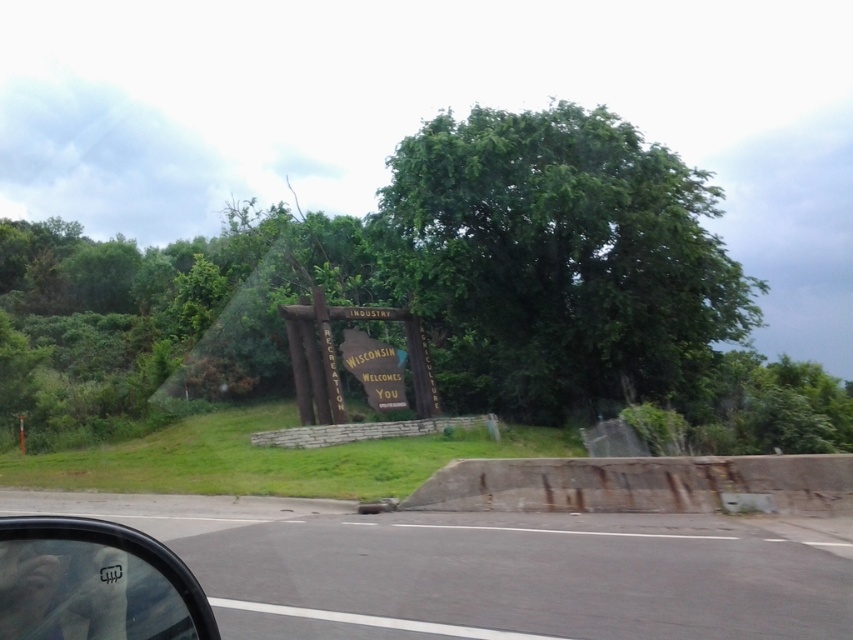
Between gray asphalt highway at center and yellow paper sign at center, which one is positioned lower?

gray asphalt highway at center is below.

Can you confirm if gray asphalt highway at center is positioned to the left of yellow paper sign at center?

Incorrect, gray asphalt highway at center is not on the left side of yellow paper sign at center.

Find the location of `gray asphalt highway at center`. gray asphalt highway at center is located at coordinates (524, 577).

Between transparent plastic car window at lower left and yellow paper sign at center, which one is positioned lower?

transparent plastic car window at lower left is below.

Does transparent plastic car window at lower left appear on the left side of yellow paper sign at center?

Correct, you'll find transparent plastic car window at lower left to the left of yellow paper sign at center.

Image resolution: width=853 pixels, height=640 pixels. Find the location of `transparent plastic car window at lower left`. transparent plastic car window at lower left is located at coordinates (94, 582).

Locate an element on the screen. The height and width of the screenshot is (640, 853). green leafy tree at center is located at coordinates (558, 260).

The height and width of the screenshot is (640, 853). Find the location of `green leafy tree at center`. green leafy tree at center is located at coordinates (x=558, y=260).